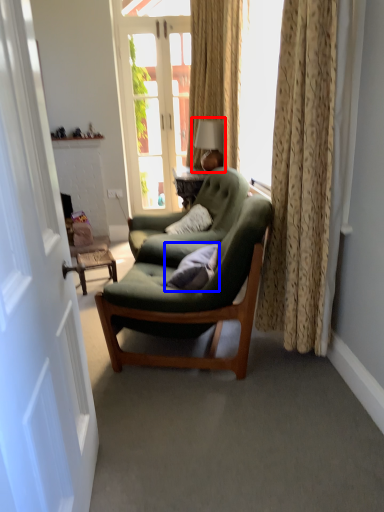
Question: Which object is closer to the camera taking this photo, table lamp (highlighted by a red box) or pillow (highlighted by a blue box)?

Choices:
 (A) table lamp
 (B) pillow

Answer: (B)